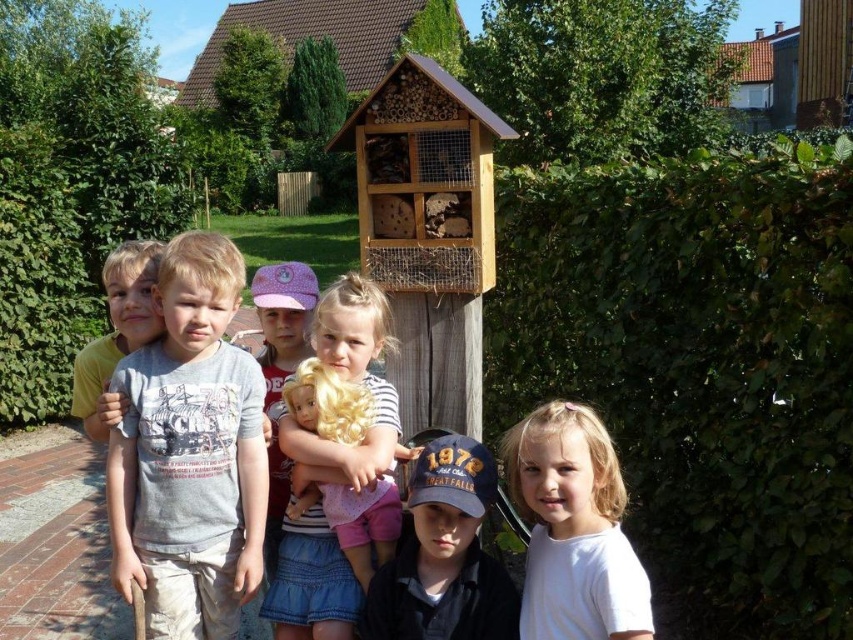
You are a photographer trying to capture a photo of the green leafy hedge at upper right and the light brown hair at center. Can you fit both subjects into the frame of your camera, considering their distance apart?

The green leafy hedge at upper right and the light brown hair at center are 7.30 feet apart. Depending on the camera lens and zoom settings, it is possible to capture both subjects in the frame if the camera can accommodate that distance.

You are a photographer trying to capture the insect hotel and the children in a single shot. You notice a specific point in the image at coordinates point (x=698, y=365). Based on the scene, what is the significance of this point?

The point (x=698, y=365) is on the green leafy hedge at upper right, which serves as the backdrop for the insect hotel and the children in the scene.

You are a photographer trying to capture a photo of the insect hotel without any obstructions. There is a green leafy hedge at upper right at point (x=698, y=365). Is the green leafy hedge at upper right blocking the view of the insect hotel?

The green leafy hedge at upper right is located at point (x=698, y=365), which is at the upper right corner of the image. Since the insect hotel is positioned against a backdrop of lush greenery, including bushes and trees, the green leafy hedge at upper right might be part of that backdrop and could be obstructing the view of the insect hotel depending on its placement.